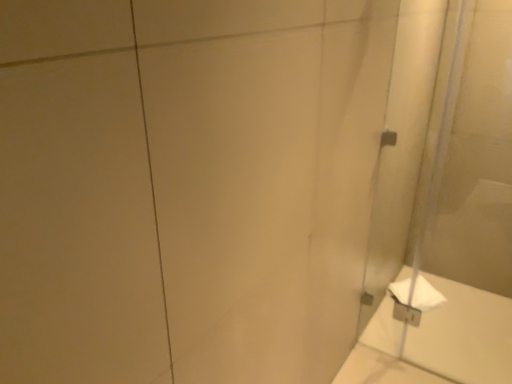
The image size is (512, 384). What are the coordinates of `white paper at right` in the screenshot? It's located at (425, 295).

What do you see at coordinates (425, 295) in the screenshot? I see `white paper at right` at bounding box center [425, 295].

Where is `white paper at right`? This screenshot has height=384, width=512. white paper at right is located at coordinates (425, 295).